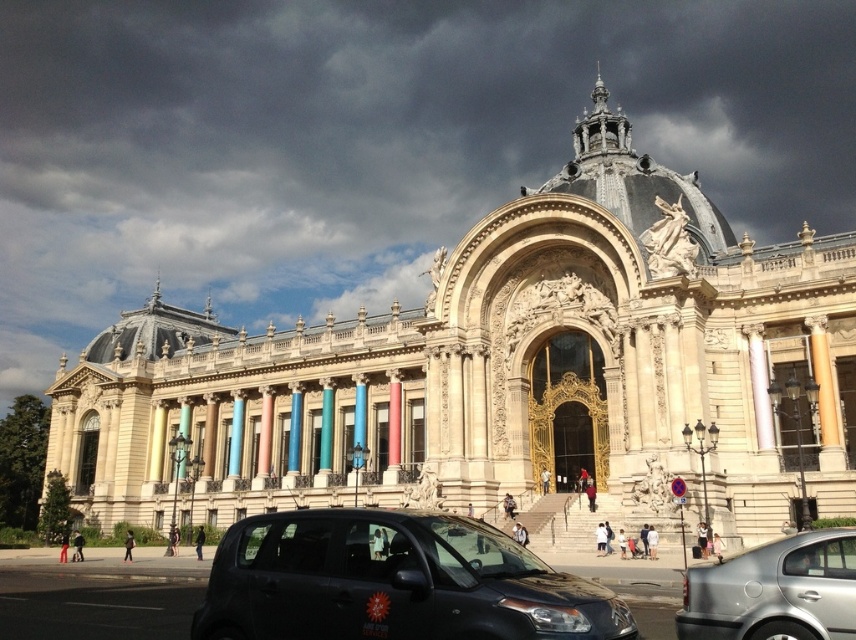
Question: Does black matte car at lower center appear on the left side of silver metallic sedan at lower right?

Choices:
 (A) yes
 (B) no

Answer: (A)

Question: Is black matte car at lower center positioned at the back of silver metallic sedan at lower right?

Choices:
 (A) yes
 (B) no

Answer: (B)

Question: Is black matte car at lower center smaller than silver metallic sedan at lower right?

Choices:
 (A) yes
 (B) no

Answer: (B)

Question: Which point appears farthest from the camera in this image?

Choices:
 (A) click(x=829, y=637)
 (B) click(x=242, y=536)

Answer: (B)